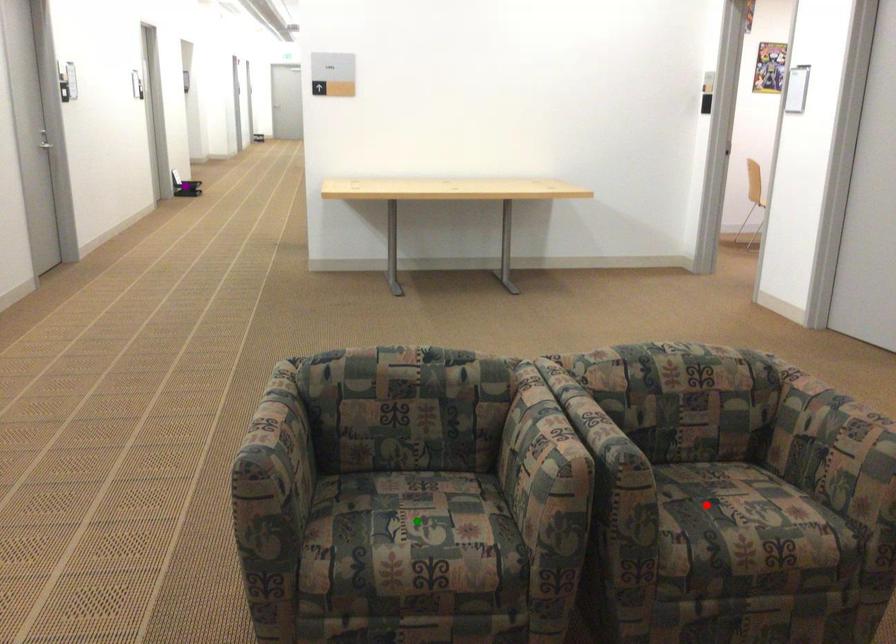
Order these from nearest to farthest:
1. purple point
2. green point
3. red point

green point
red point
purple point